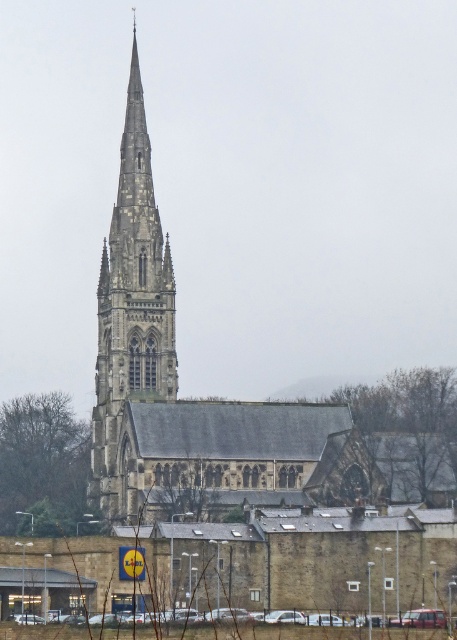
Question: Among these objects, which one is farthest from the camera?

Choices:
 (A) stone gothic tower at center
 (B) stone church steeple at center

Answer: (A)

Question: Can you confirm if stone church steeple at center is positioned to the left of stone gothic tower at center?

Choices:
 (A) no
 (B) yes

Answer: (A)

Question: Can you confirm if stone church steeple at center is thinner than stone gothic tower at center?

Choices:
 (A) no
 (B) yes

Answer: (A)

Question: Can you confirm if stone church steeple at center is thinner than stone gothic tower at center?

Choices:
 (A) yes
 (B) no

Answer: (B)

Question: Which of the following is the farthest from the observer?

Choices:
 (A) (111, 467)
 (B) (138, 490)

Answer: (A)